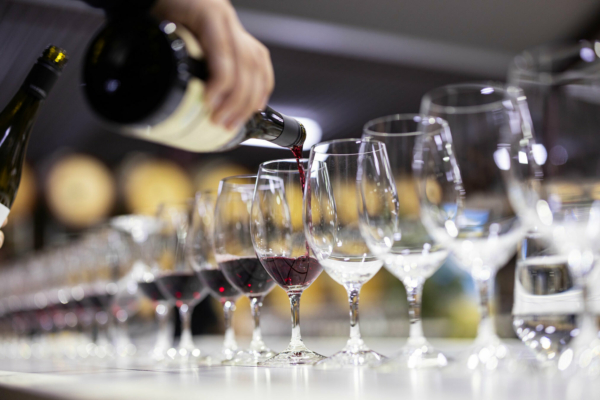
Identify the location of empity glasses. (567, 125), (496, 145), (379, 193), (331, 209).